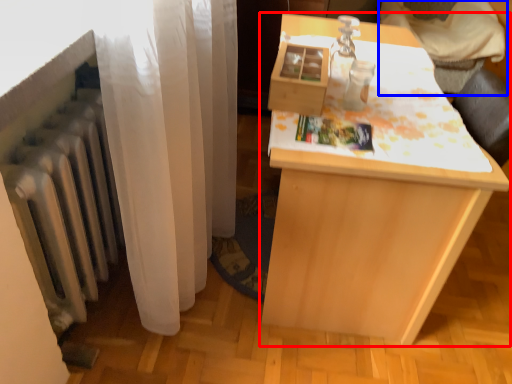
Question: Which of the following is the closest to the observer, table (highlighted by a red box) or furniture (highlighted by a blue box)?

Choices:
 (A) table
 (B) furniture

Answer: (A)